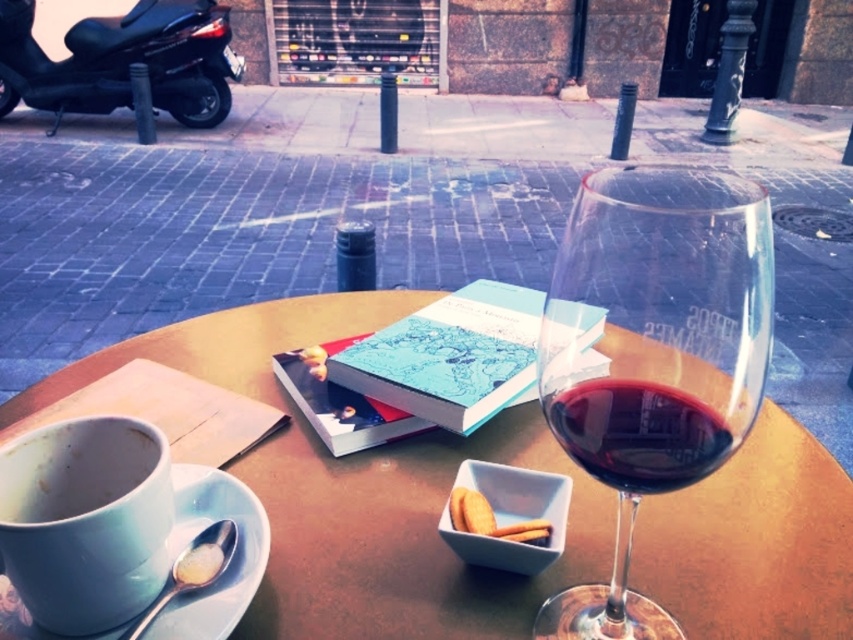
You are a delivery person who needs to place a package on the matte brown table at center. Your scooter, the black matte scooter at upper left, is currently parked 4.35 meters away. Can you reach the table without moving the scooter?

The distance between the matte brown table at center and the black matte scooter at upper left is 4.35 meters. Since you need to reach the table to place the package, you will have to move the scooter closer to access it, as the current distance is too far to reach from the scooter.

You are planning to park your scooter at the outdoor cafe. The cafe has a designated scooter parking area at point 0.1, 0.15. Is the black matte scooter at upper left parked correctly?

The black matte scooter at upper left is located at point (123, 60), which is very close to the designated parking area at (126, 64). Depending on the cafe rules, it might be considered correctly parked.

You are a delivery person who needs to place a package on the white matte biscuit at center. Your scooter, the black matte scooter at upper left, is currently blocking the path. Can you move the scooter to access the biscuit without moving it more than 5 meters?

The distance between the black matte scooter at upper left and the white matte biscuit at center is 4.77 meters. Since the required movement is less than 5 meters, you can move the scooter to access the biscuit.